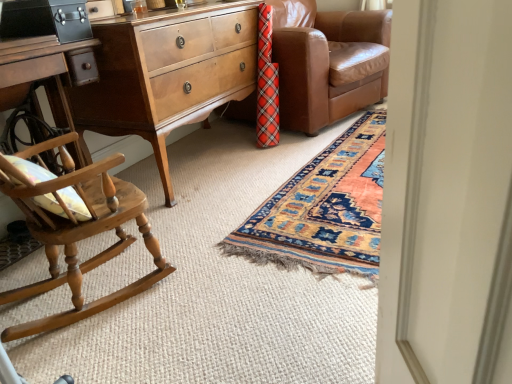
Image resolution: width=512 pixels, height=384 pixels. Describe the element at coordinates (167, 74) in the screenshot. I see `light brown wood nightstand at left` at that location.

At what (x,y) coordinates should I click in order to perform the action: click on wooden rocking chair at left. Please return your answer as a coordinate pair (x, y). Looking at the image, I should click on click(78, 232).

Between light brown wood nightstand at left and black leather briefcase at upper left, which one is positioned behind?

light brown wood nightstand at left is more distant.

From a real-world perspective, is light brown wood nightstand at left positioned above or below black leather briefcase at upper left?

In terms of real-world spatial position, light brown wood nightstand at left is below black leather briefcase at upper left.

Between point (163, 126) and point (10, 32), which one is positioned behind?

The point (163, 126) is behind.

Locate an element on the screen. studio couch behind the wooden rocking chair at left is located at coordinates (328, 62).

Which object is further away from the camera taking this photo, brown leather couch at center or wooden rocking chair at left?

brown leather couch at center is further from the camera.

Is point (288, 44) positioned in front of point (73, 255)?

No.

Between brown leather couch at center and wooden rocking chair at left, which one appears on the right side from the viewer's perspective?

Positioned to the right is brown leather couch at center.

Considering the sizes of brown leather couch at center and light brown wood nightstand at left in the image, is brown leather couch at center wider or thinner than light brown wood nightstand at left?

Clearly, brown leather couch at center has more width compared to light brown wood nightstand at left.

From a real-world perspective, is brown leather couch at center physically located above or below light brown wood nightstand at left?

From a real-world perspective, brown leather couch at center is physically above light brown wood nightstand at left.

Considering the sizes of objects brown leather couch at center and light brown wood nightstand at left in the image provided, who is smaller, brown leather couch at center or light brown wood nightstand at left?

Smaller between the two is light brown wood nightstand at left.

In the scene shown: Is the surface of black leather briefcase at upper left in direct contact with brown leather couch at center?

They are not placed beside each other.

Is black leather briefcase at upper left in front of or behind brown leather couch at center in the image?

black leather briefcase at upper left is in front of brown leather couch at center.

From a real-world perspective, is black leather briefcase at upper left physically below brown leather couch at center?

No, from a real-world perspective, black leather briefcase at upper left is not beneath brown leather couch at center.

From the picture: Is black leather briefcase at upper left beside wooden rocking chair at left?

No, black leather briefcase at upper left is not next to wooden rocking chair at left.

Is black leather briefcase at upper left oriented towards wooden rocking chair at left?

No, black leather briefcase at upper left is not facing towards wooden rocking chair at left.

Is black leather briefcase at upper left located outside wooden rocking chair at left?

Yes, black leather briefcase at upper left is not within wooden rocking chair at left.

Is black leather briefcase at upper left to the right of wooden rocking chair at left from the viewer's perspective?

In fact, black leather briefcase at upper left is to the left of wooden rocking chair at left.

Is wooden rocking chair at left spatially inside black leather briefcase at upper left, or outside of it?

wooden rocking chair at left is located beyond the bounds of black leather briefcase at upper left.

Is wooden rocking chair at left far from black leather briefcase at upper left?

That's not correct — wooden rocking chair at left is a little close to black leather briefcase at upper left.

Considering the positions of point (106, 249) and point (44, 17), is point (106, 249) closer or farther from the camera than point (44, 17)?

Point (106, 249) is positioned closer to the camera compared to point (44, 17).

Between wooden rocking chair at left and black leather briefcase at upper left, which one is positioned in front?

Positioned in front is wooden rocking chair at left.

Between brown leather couch at center and black leather briefcase at upper left, which one has smaller width?

Thinner between the two is black leather briefcase at upper left.

From the image's perspective, is brown leather couch at center located above or below black leather briefcase at upper left?

Clearly, from the image's perspective, brown leather couch at center is above black leather briefcase at upper left.

Could you tell me if brown leather couch at center is facing black leather briefcase at upper left?

No, brown leather couch at center does not turn towards black leather briefcase at upper left.

Considering the relative sizes of brown leather couch at center and black leather briefcase at upper left in the image provided, is brown leather couch at center taller than black leather briefcase at upper left?

Indeed, brown leather couch at center has a greater height compared to black leather briefcase at upper left.

At what (x,y) coordinates should I click in order to perform the action: click on cabinetry above the light brown wood nightstand at left (from a real-world perspective). Please return your answer as a coordinate pair (x, y). Looking at the image, I should click on (46, 19).

This screenshot has height=384, width=512. What are the coordinates of `chair below the brown leather couch at center (from the image's perspective)` in the screenshot? It's located at (78, 232).

Looking at this image, based on their spatial positions, is brown leather couch at center or light brown wood nightstand at left closer to black leather briefcase at upper left?

Based on the image, light brown wood nightstand at left appears to be nearer to black leather briefcase at upper left.

Looking at the image, which one is located further to wooden rocking chair at left, black leather briefcase at upper left or light brown wood nightstand at left?

light brown wood nightstand at left is positioned further to the anchor wooden rocking chair at left.

Based on their spatial positions, is light brown wood nightstand at left or black leather briefcase at upper left further from brown leather couch at center?

black leather briefcase at upper left.

When comparing their distances from black leather briefcase at upper left, does wooden rocking chair at left or light brown wood nightstand at left seem further?

Among the two, wooden rocking chair at left is located further to black leather briefcase at upper left.

When comparing their distances from brown leather couch at center, does black leather briefcase at upper left or wooden rocking chair at left seem further?

wooden rocking chair at left lies further to brown leather couch at center than the other object.

From the image, which object appears to be nearer to brown leather couch at center, light brown wood nightstand at left or wooden rocking chair at left?

The object closer to brown leather couch at center is light brown wood nightstand at left.

Considering their positions, is light brown wood nightstand at left positioned further to wooden rocking chair at left than black leather briefcase at upper left?

Based on the image, light brown wood nightstand at left appears to be further to wooden rocking chair at left.

Based on their spatial positions, is brown leather couch at center or black leather briefcase at upper left closer to light brown wood nightstand at left?

black leather briefcase at upper left is closer to light brown wood nightstand at left.

This screenshot has width=512, height=384. Identify the location of nightstand between wooden rocking chair at left and brown leather couch at center along the z-axis. point(167,74).

Image resolution: width=512 pixels, height=384 pixels. Find the location of `nightstand between black leather briefcase at upper left and brown leather couch at center from left to right`. nightstand between black leather briefcase at upper left and brown leather couch at center from left to right is located at coordinates (167, 74).

Find the location of a particular element. cabinetry located between wooden rocking chair at left and light brown wood nightstand at left in the depth direction is located at coordinates (46, 19).

At what (x,y) coordinates should I click in order to perform the action: click on chair located between black leather briefcase at upper left and brown leather couch at center in the left-right direction. Please return your answer as a coordinate pair (x, y). The width and height of the screenshot is (512, 384). Looking at the image, I should click on (78, 232).